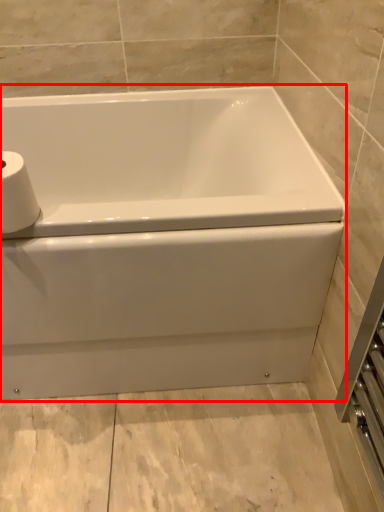
Question: From the image's perspective, what is the correct spatial positioning of bathtub (annotated by the red box) in reference to toilet paper?

Choices:
 (A) below
 (B) above

Answer: (A)